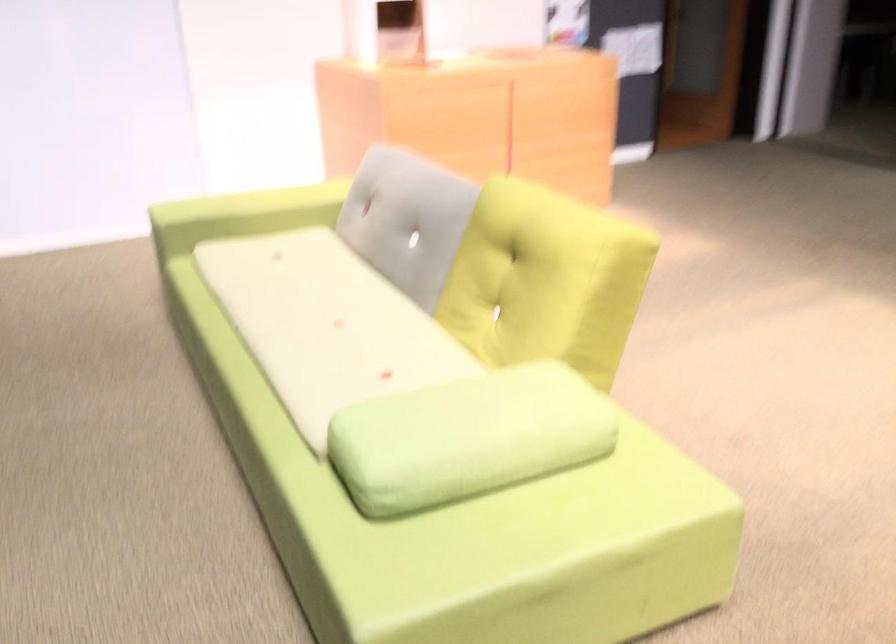
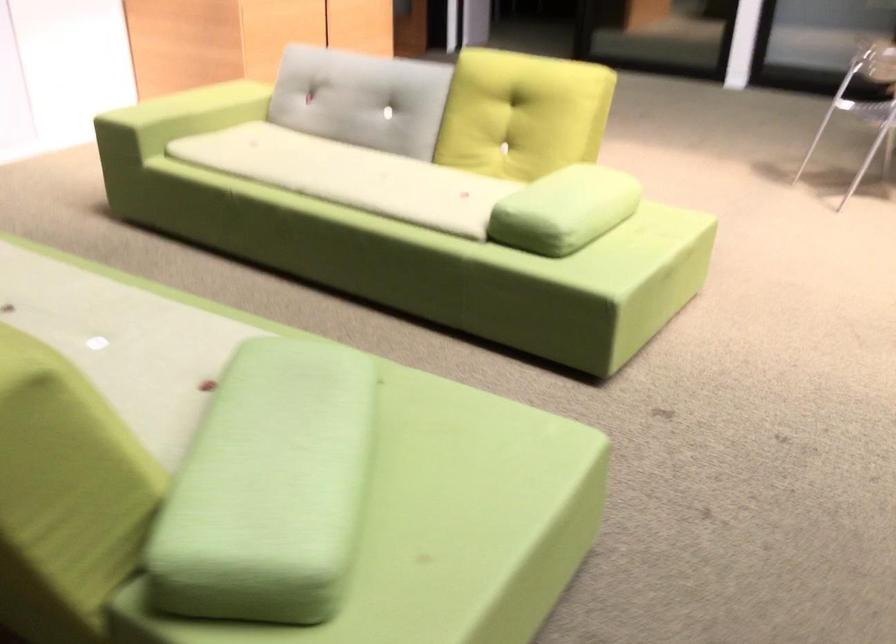
The point at [390,225] is marked in the first image. Where is the corresponding point in the second image?

(362, 99)